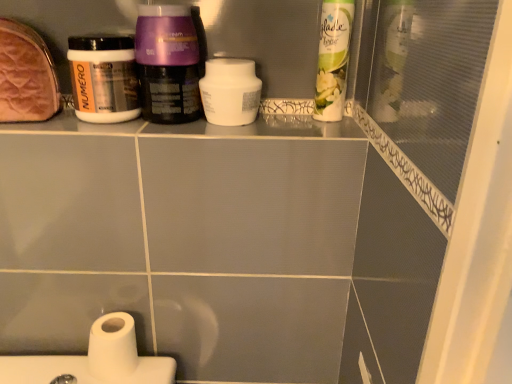
Locate an element on the screen. Image resolution: width=512 pixels, height=384 pixels. purple glossy cream at center, the first bottle when ordered from right to left is located at coordinates (168, 64).

Find the location of `leather-like brown pouch at upper left`. leather-like brown pouch at upper left is located at coordinates (26, 75).

What is the approximate height of white matte toilet paper at lower left?

white matte toilet paper at lower left is 3.71 inches tall.

Locate an element on the screen. white glossy air freshener at upper right, the second cleaning product when ordered from left to right is located at coordinates (333, 59).

Is purple glossy cream at center, the first bottle when ordered from right to left, with white matte jar at center, which is counted as the 2th cleaning product, starting from the right?

Absolutely, purple glossy cream at center, the first bottle when ordered from right to left, is next to and touching white matte jar at center, which is counted as the 2th cleaning product, starting from the right.

Consider the image. Is purple glossy cream at center, the first bottle when ordered from right to left, inside the boundaries of white matte jar at center, which is counted as the 2th cleaning product, starting from the right, or outside?

purple glossy cream at center, the first bottle when ordered from right to left, is outside white matte jar at center, which is counted as the 2th cleaning product, starting from the right.

How many degrees apart are the facing directions of purple glossy cream at center, which is the 2th bottle in left-to-right order, and white matte jar at center, which is counted as the 2th cleaning product, starting from the right?

The facing directions of purple glossy cream at center, which is the 2th bottle in left-to-right order, and white matte jar at center, which is counted as the 2th cleaning product, starting from the right, are 6.17 degrees apart.

From a real-world perspective, between purple glossy cream at center, the first bottle when ordered from right to left, and leather-like brown pouch at upper left, who is vertically higher?

purple glossy cream at center, the first bottle when ordered from right to left, from a real-world perspective.

In the image, there is a purple glossy cream at center, the first bottle when ordered from right to left. At what (x,y) coordinates should I click in order to perform the action: click on product below it (from a real-world perspective). Please return your answer as a coordinate pair (x, y). Image resolution: width=512 pixels, height=384 pixels. Looking at the image, I should click on (26, 75).

Is leather-like brown pouch at upper left completely or partially inside purple glossy cream at center, which is the 2th bottle in left-to-right order?

No, leather-like brown pouch at upper left is located outside of purple glossy cream at center, which is the 2th bottle in left-to-right order.

Could you tell me if purple glossy cream at center, which is the 2th bottle in left-to-right order, is facing leather-like brown pouch at upper left?

No, purple glossy cream at center, which is the 2th bottle in left-to-right order, is not facing towards leather-like brown pouch at upper left.

Between point (109, 339) and point (161, 12), which one is positioned behind?

The point (109, 339) is farther.

Where is `bottle on the right of white matte toilet paper at lower left`? Image resolution: width=512 pixels, height=384 pixels. bottle on the right of white matte toilet paper at lower left is located at coordinates (168, 64).

From the image's perspective, is white matte toilet paper at lower left above or below purple glossy cream at center, the first bottle when ordered from right to left?

white matte toilet paper at lower left is below purple glossy cream at center, the first bottle when ordered from right to left.

Is white matte toilet paper at lower left located outside purple glossy cream at center, the first bottle when ordered from right to left?

That's correct, white matte toilet paper at lower left is outside of purple glossy cream at center, the first bottle when ordered from right to left.

Where is `bottle above the leather-like brown pouch at upper left (from a real-world perspective)`? The image size is (512, 384). bottle above the leather-like brown pouch at upper left (from a real-world perspective) is located at coordinates (168, 64).

Are leather-like brown pouch at upper left and purple glossy cream at center, the first bottle when ordered from right to left, beside each other?

No, leather-like brown pouch at upper left is not making contact with purple glossy cream at center, the first bottle when ordered from right to left.

Would you say leather-like brown pouch at upper left is to the left or to the right of purple glossy cream at center, which is the 2th bottle in left-to-right order, in the picture?

Clearly, leather-like brown pouch at upper left is on the left of purple glossy cream at center, which is the 2th bottle in left-to-right order, in the image.

How many degrees apart are the facing directions of leather-like brown pouch at upper left and purple glossy cream at center, which is the 2th bottle in left-to-right order?

The angle between the facing direction of leather-like brown pouch at upper left and the facing direction of purple glossy cream at center, which is the 2th bottle in left-to-right order, is 5.12 degrees.

Considering the relative positions of white matte jar at upper left, which ranks as the 2th bottle in right-to-left order, and white glossy air freshener at upper right, the second cleaning product when ordered from left to right, in the image provided, is white matte jar at upper left, which ranks as the 2th bottle in right-to-left order, to the left or to the right of white glossy air freshener at upper right, the second cleaning product when ordered from left to right,?

From the image, it's evident that white matte jar at upper left, which ranks as the 2th bottle in right-to-left order, is to the left of white glossy air freshener at upper right, the second cleaning product when ordered from left to right.

You are a GUI agent. You are given a task and a screenshot of the screen. Output one action in this format:
    pyautogui.click(x=<x>, y=<y>)
    Task: Click on the bottle that is the 1st one when counting forward from the white glossy air freshener at upper right, the second cleaning product when ordered from left to right
    Image resolution: width=512 pixels, height=384 pixels.
    Given the screenshot: What is the action you would take?
    click(x=104, y=78)

Consider the image. Is white matte jar at upper left, the 1th bottle from the left, taller than white glossy air freshener at upper right, which is the first cleaning product from right to left?

Incorrect, the height of white matte jar at upper left, the 1th bottle from the left, is not larger of that of white glossy air freshener at upper right, which is the first cleaning product from right to left.

Does point (123, 62) come closer to viewer compared to point (327, 118)?

Yes, it is.

Can you confirm if leather-like brown pouch at upper left is positioned to the left of white matte toilet paper at lower left?

Yes, leather-like brown pouch at upper left is to the left of white matte toilet paper at lower left.

From the image's perspective, is leather-like brown pouch at upper left located above or below white matte toilet paper at lower left?

leather-like brown pouch at upper left is above white matte toilet paper at lower left.

Can you tell me how much leather-like brown pouch at upper left and white matte toilet paper at lower left differ in facing direction?

The angular difference between leather-like brown pouch at upper left and white matte toilet paper at lower left is 0.127 degrees.

Are leather-like brown pouch at upper left and white matte toilet paper at lower left making contact?

No, leather-like brown pouch at upper left is not touching white matte toilet paper at lower left.

Does white matte jar at center, placed as the first cleaning product when sorted from left to right, appear on the left side of white matte toilet paper at lower left?

No, white matte jar at center, placed as the first cleaning product when sorted from left to right, is not to the left of white matte toilet paper at lower left.

Can you confirm if white matte jar at center, which is counted as the 2th cleaning product, starting from the right, is bigger than white matte toilet paper at lower left?

Actually, white matte jar at center, which is counted as the 2th cleaning product, starting from the right, might be smaller than white matte toilet paper at lower left.

Which object is thinner, white matte jar at center, which is counted as the 2th cleaning product, starting from the right, or white matte toilet paper at lower left?

white matte jar at center, which is counted as the 2th cleaning product, starting from the right.

Identify the location of cleaning product located underneath the purple glossy cream at center, which is the 2th bottle in left-to-right order (from a real-world perspective). (230, 91).

Where is `product that is in front of the purple glossy cream at center, the first bottle when ordered from right to left`? Image resolution: width=512 pixels, height=384 pixels. product that is in front of the purple glossy cream at center, the first bottle when ordered from right to left is located at coordinates (26, 75).

Based on the photo, from the image, which object appears to be nearer to white glossy air freshener at upper right, the second cleaning product when ordered from left to right, purple glossy cream at center, which is the 2th bottle in left-to-right order, or white matte jar at center, which is counted as the 2th cleaning product, starting from the right?

white matte jar at center, which is counted as the 2th cleaning product, starting from the right, is positioned closer to the anchor white glossy air freshener at upper right, the second cleaning product when ordered from left to right.

Based on their spatial positions, is white glossy air freshener at upper right, which is the first cleaning product from right to left, or leather-like brown pouch at upper left further from purple glossy cream at center, which is the 2th bottle in left-to-right order?

white glossy air freshener at upper right, which is the first cleaning product from right to left.

Which object lies further to the anchor point white matte jar at upper left, which ranks as the 2th bottle in right-to-left order, leather-like brown pouch at upper left or white matte jar at center, which is counted as the 2th cleaning product, starting from the right?

The object further to white matte jar at upper left, which ranks as the 2th bottle in right-to-left order, is white matte jar at center, which is counted as the 2th cleaning product, starting from the right.

In the scene shown: Based on their spatial positions, is white matte toilet paper at lower left or white matte jar at upper left, the 1th bottle from the left, further from white matte jar at center, placed as the first cleaning product when sorted from left to right?

white matte toilet paper at lower left is positioned further to the anchor white matte jar at center, placed as the first cleaning product when sorted from left to right.

Estimate the real-world distances between objects in this image. Which object is further from white glossy air freshener at upper right, the second cleaning product when ordered from left to right, white matte toilet paper at lower left or purple glossy cream at center, the first bottle when ordered from right to left?

white matte toilet paper at lower left is further to white glossy air freshener at upper right, the second cleaning product when ordered from left to right.

Looking at this image, looking at the image, which one is located closer to white matte jar at center, which is counted as the 2th cleaning product, starting from the right, leather-like brown pouch at upper left or white matte toilet paper at lower left?

leather-like brown pouch at upper left is positioned closer to the anchor white matte jar at center, which is counted as the 2th cleaning product, starting from the right.

When comparing their distances from white matte jar at center, which is counted as the 2th cleaning product, starting from the right, does leather-like brown pouch at upper left or white matte jar at upper left, the 1th bottle from the left, seem further?

Among the two, leather-like brown pouch at upper left is located further to white matte jar at center, which is counted as the 2th cleaning product, starting from the right.

Which object lies further to the anchor point white matte toilet paper at lower left, white matte jar at upper left, which ranks as the 2th bottle in right-to-left order, or purple glossy cream at center, which is the 2th bottle in left-to-right order?

purple glossy cream at center, which is the 2th bottle in left-to-right order.

Locate an element on the screen. This screenshot has height=384, width=512. bottle situated between white matte jar at upper left, the 1th bottle from the left, and white matte jar at center, which is counted as the 2th cleaning product, starting from the right, from left to right is located at coordinates (168, 64).

Locate an element on the screen. This screenshot has width=512, height=384. bottle situated between leather-like brown pouch at upper left and purple glossy cream at center, which is the 2th bottle in left-to-right order, from left to right is located at coordinates (104, 78).

The width and height of the screenshot is (512, 384). I want to click on cleaning product between leather-like brown pouch at upper left and white matte toilet paper at lower left vertically, so click(230, 91).

At what (x,y) coordinates should I click in order to perform the action: click on bottle between purple glossy cream at center, the first bottle when ordered from right to left, and white matte toilet paper at lower left in the up-down direction. Please return your answer as a coordinate pair (x, y). Looking at the image, I should click on (104, 78).